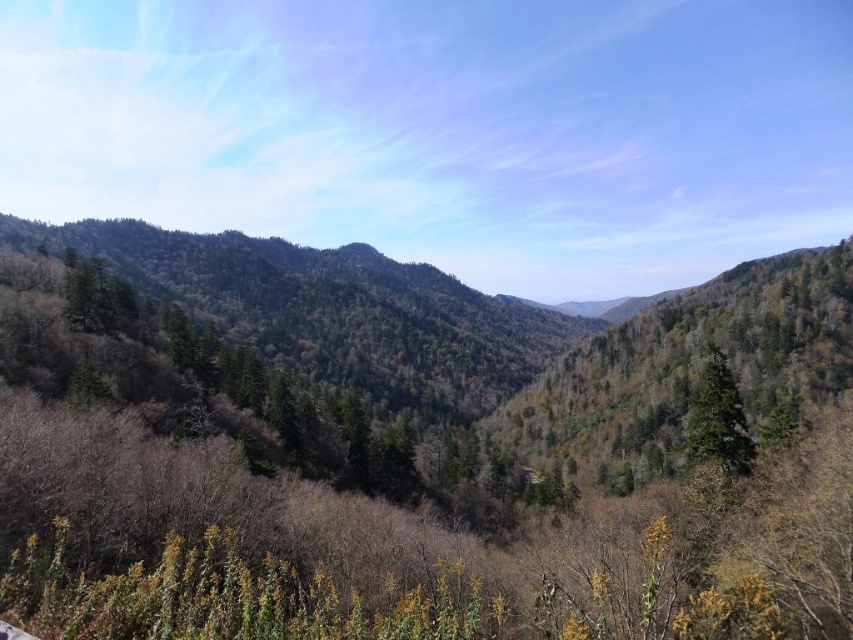
Is green textured forest at center bigger than green matte tree at center-right?

Indeed, green textured forest at center has a larger size compared to green matte tree at center-right.

Is the position of green textured forest at center less distant than that of green matte tree at center-right?

No, it is not.

Between point (753, 413) and point (692, 433), which one is positioned in front?

Point (692, 433) is in front.

This screenshot has height=640, width=853. In order to click on green textured forest at center in this screenshot , I will do `click(495, 336)`.